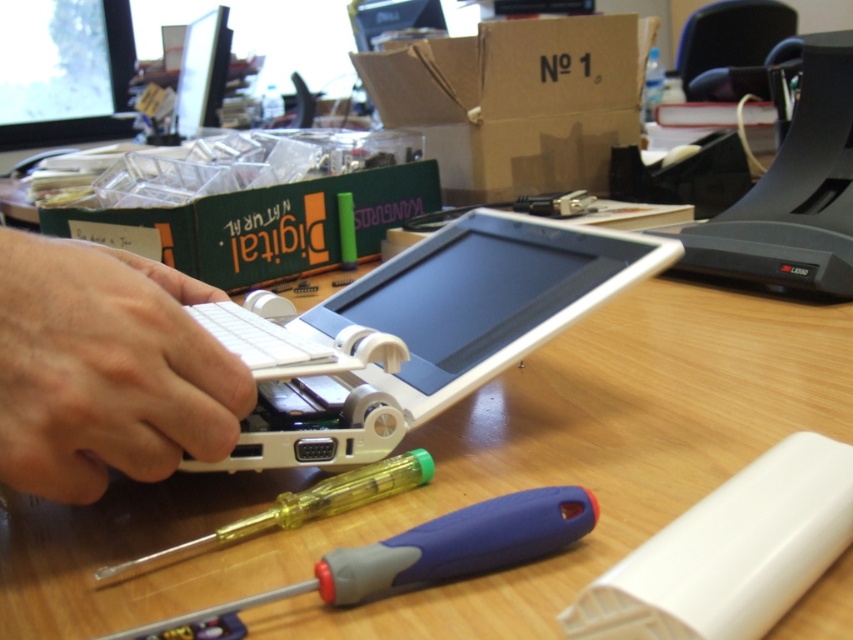
Does blue plastic screwdriver at lower center have a greater width compared to yellow plastic screwdriver at center?

Yes.

Which of these two, blue plastic screwdriver at lower center or yellow plastic screwdriver at center, stands taller?

Standing taller between the two is yellow plastic screwdriver at center.

Does point (563, 538) lie in front of point (421, 461)?

Yes, it is in front of point (421, 461).

This screenshot has width=853, height=640. I want to click on blue plastic screwdriver at lower center, so click(x=428, y=552).

Between white plastic tablet at center and blue plastic screwdriver at lower center, which one appears on the left side from the viewer's perspective?

white plastic tablet at center is more to the left.

Does white plastic tablet at center come behind blue plastic screwdriver at lower center?

Yes, white plastic tablet at center is behind blue plastic screwdriver at lower center.

Is point (360, 307) positioned in front of point (325, 563)?

No.

Locate an element on the screen. This screenshot has height=640, width=853. white plastic tablet at center is located at coordinates (433, 333).

Is wooden table at center shorter than blue plastic screwdriver at lower center?

No, wooden table at center is not shorter than blue plastic screwdriver at lower center.

Locate an element on the screen. This screenshot has height=640, width=853. wooden table at center is located at coordinates (691, 388).